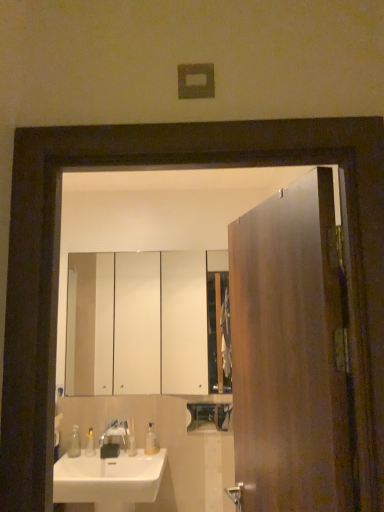
Question: From the image's perspective, is translucent plastic soap at lower left, which is counted as the 2th toiletry, starting from the right, positioned above or below white glossy sink at lower left?

Choices:
 (A) above
 (B) below

Answer: (A)

Question: Is translucent plastic soap at lower left, which is the first toiletry in left-to-right order, wider or thinner than white glossy sink at lower left?

Choices:
 (A) wide
 (B) thin

Answer: (B)

Question: Which is farther from the satin nickel faucet at sink left?

Choices:
 (A) white glossy sink at lower left
 (B) wooden door at right
 (C) translucent plastic soap at lower left, which is counted as the 2th toiletry, starting from the right
 (D) translucent plastic soap at center, marked as the first toiletry in a right-to-left arrangement
 (E) white glossy cabinet at upper center

Answer: (E)

Question: Which of these objects is positioned closest to the white glossy cabinet at upper center?

Choices:
 (A) translucent plastic soap at lower left, which is the first toiletry in left-to-right order
 (B) satin nickel faucet at sink left
 (C) clear plastic soap dispenser at lower left, the second soap dispenser viewed from the right
 (D) white glossy sink at lower left
 (E) transparent plastic soap dispenser at lower center, the 2th soap dispenser from the left

Answer: (B)